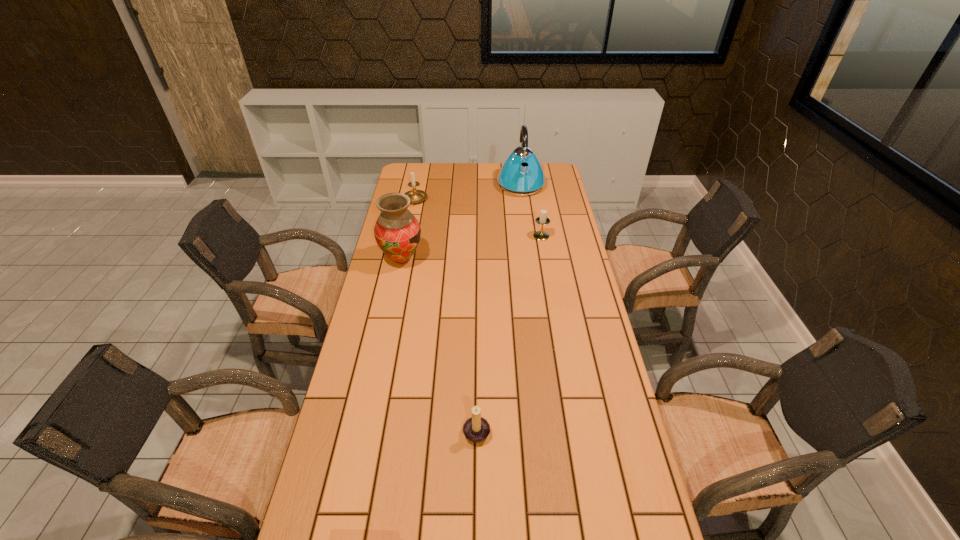
The image size is (960, 540). I want to click on vacant space located 0.190m on the back of the rightmost candle holder, so click(536, 206).

You are a GUI agent. You are given a task and a screenshot of the screen. Output one action in this format:
    pyautogui.click(x=<x>, y=<y>)
    Task: Click on the blank space located 0.050m on the wick of the third object from left to right
    The image size is (960, 540).
    Given the screenshot: What is the action you would take?
    pyautogui.click(x=509, y=429)

Identify the location of object at the far edge. The image size is (960, 540). (521, 174).

The height and width of the screenshot is (540, 960). I want to click on vase that is positioned at the left edge, so click(x=397, y=232).

The image size is (960, 540). I want to click on candle holder located at the left edge, so click(x=415, y=195).

The image size is (960, 540). I want to click on kettle that is positioned at the right edge, so click(x=521, y=174).

At what (x,y) coordinates should I click in order to perform the action: click on candle holder at the right edge. Please return your answer as a coordinate pair (x, y). This screenshot has height=540, width=960. Looking at the image, I should click on (542, 220).

I want to click on object that is positioned at the far right corner, so click(x=521, y=174).

The height and width of the screenshot is (540, 960). I want to click on free space at the left edge of the desktop, so click(348, 455).

I want to click on vacant space at the right edge, so click(x=571, y=423).